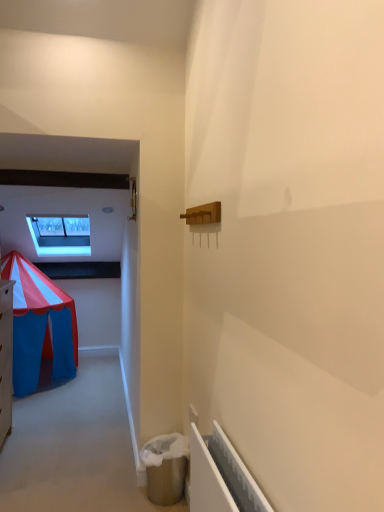
Question: Considering the positions of transparent glass window at upper left and white plastic radiator at lower right in the image, is transparent glass window at upper left taller or shorter than white plastic radiator at lower right?

Choices:
 (A) tall
 (B) short

Answer: (A)

Question: Do you think transparent glass window at upper left is within white plastic radiator at lower right, or outside of it?

Choices:
 (A) outside
 (B) inside

Answer: (A)

Question: Is point (69, 254) positioned closer to the camera than point (208, 509)?

Choices:
 (A) farther
 (B) closer

Answer: (A)

Question: From a real-world perspective, is white plastic radiator at lower right physically located above or below transparent glass window at upper left?

Choices:
 (A) below
 (B) above

Answer: (A)

Question: Is point (228, 478) closer or farther from the camera than point (79, 240)?

Choices:
 (A) closer
 (B) farther

Answer: (A)

Question: In terms of height, does white plastic radiator at lower right look taller or shorter compared to transparent glass window at upper left?

Choices:
 (A) tall
 (B) short

Answer: (B)

Question: Is white plastic radiator at lower right to the left or to the right of transparent glass window at upper left in the image?

Choices:
 (A) right
 (B) left

Answer: (A)